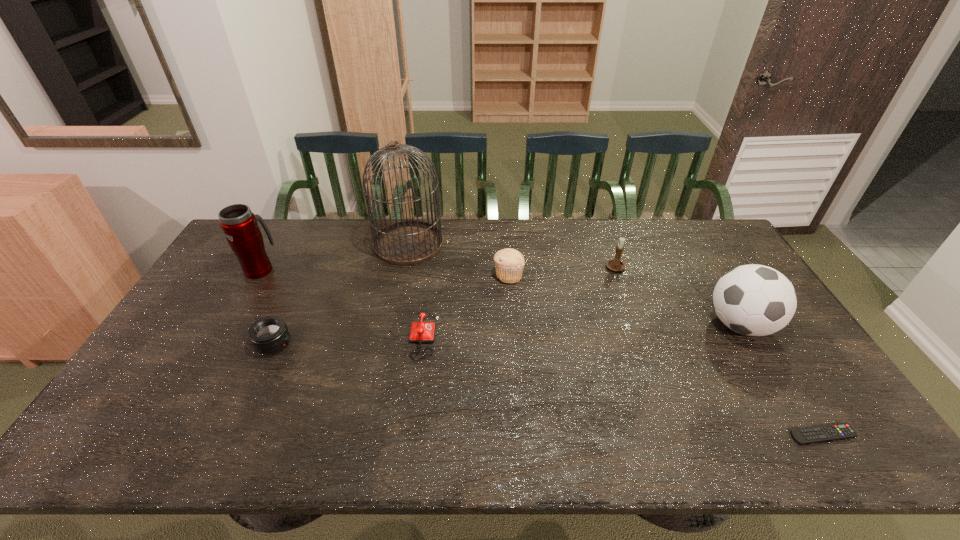
The image size is (960, 540). Identify the location of blank region between the fifth object from left to right and the remote control. (665, 355).

This screenshot has height=540, width=960. Find the location of `free space between the leftmost object and the fifth shortest object`. free space between the leftmost object and the fifth shortest object is located at coordinates [439, 269].

Where is `free spot between the candle holder and the muffin`? This screenshot has width=960, height=540. free spot between the candle holder and the muffin is located at coordinates (563, 272).

Identify the location of vacant area between the tallest object and the leftmost object. (335, 256).

This screenshot has width=960, height=540. In order to click on free spot between the muffin and the leftmost object in this screenshot , I will do `click(384, 272)`.

Image resolution: width=960 pixels, height=540 pixels. What are the coordinates of `vacant point located between the seventh tallest object and the soccer ball` in the screenshot? It's located at (577, 330).

Where is `vacant space that's between the second shortest object and the leftmost object`? vacant space that's between the second shortest object and the leftmost object is located at coordinates (337, 302).

Image resolution: width=960 pixels, height=540 pixels. I want to click on empty space that is in between the sixth shortest object and the telephone, so click(x=577, y=330).

Where is `free point between the telephone and the birdcage`? The width and height of the screenshot is (960, 540). free point between the telephone and the birdcage is located at coordinates (411, 289).

The image size is (960, 540). I want to click on unoccupied area between the telephoto lens and the candle holder, so click(445, 306).